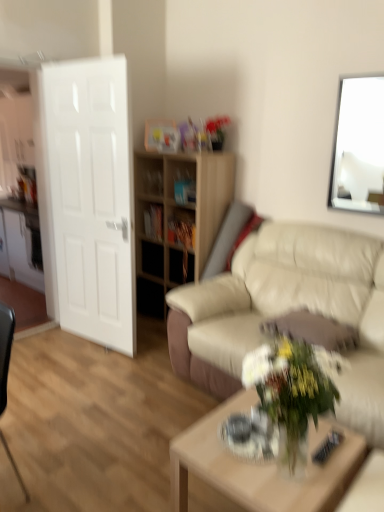
Where is `free location to the left of white glossy door at left`? This screenshot has width=384, height=512. free location to the left of white glossy door at left is located at coordinates pyautogui.click(x=54, y=346).